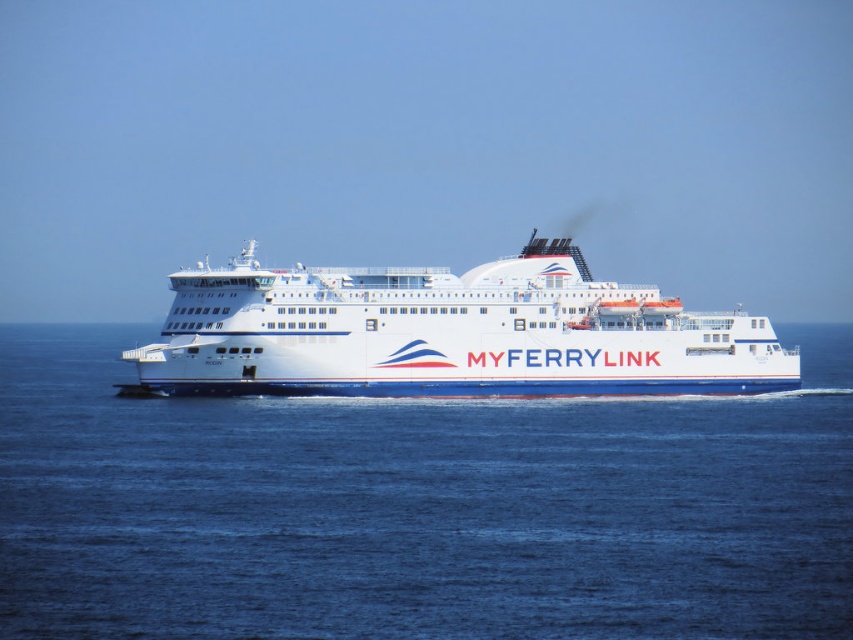
Between point (656, 512) and point (479, 282), which one is positioned in front?

Point (656, 512)

Consider the image. Is blue water at center smaller than white glossy ferry at center?

No, blue water at center is not smaller than white glossy ferry at center.

What do you see at coordinates (416, 506) in the screenshot? The height and width of the screenshot is (640, 853). I see `blue water at center` at bounding box center [416, 506].

The width and height of the screenshot is (853, 640). I want to click on blue water at center, so click(x=416, y=506).